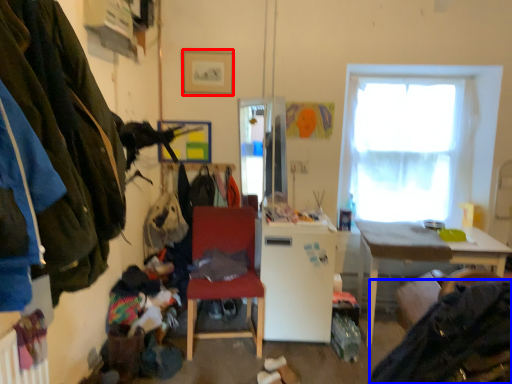
Question: Which point is closer to the camera, picture frame (highlighted by a red box) or clothing (highlighted by a blue box)?

Choices:
 (A) picture frame
 (B) clothing

Answer: (B)